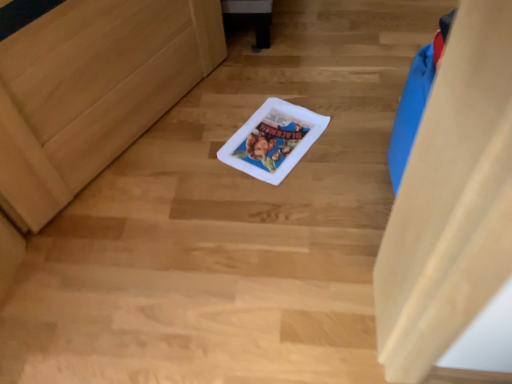
Where is `white matte comic book at center`? white matte comic book at center is located at coordinates (273, 140).

What do you see at coordinates (273, 140) in the screenshot? I see `white matte comic book at center` at bounding box center [273, 140].

Locate an element on the screen. Image resolution: width=512 pixels, height=384 pixels. white matte comic book at center is located at coordinates (273, 140).